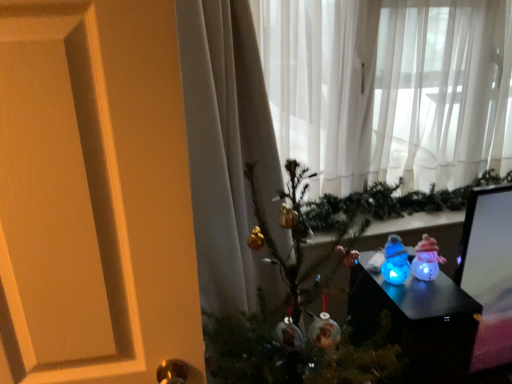
Question: From a real-world perspective, relative to translucent plastic snowmen at lower right, is sheer white curtain at upper center vertically above or below?

Choices:
 (A) below
 (B) above

Answer: (B)

Question: Would you say sheer white curtain at upper center is to the left or to the right of translucent plastic snowmen at lower right in the picture?

Choices:
 (A) left
 (B) right

Answer: (B)

Question: Estimate the real-world distances between objects in this image. Which object is farther from the metallic gold ornaments at center?

Choices:
 (A) sheer white curtain at upper center
 (B) translucent plastic snowman at center-right, the 2th toy viewed from the left
 (C) translucent plastic snowmen at lower right
 (D) blue translucent snowman at center, the first toy from the left

Answer: (A)

Question: Based on their relative distances, which object is nearer to the translucent plastic snowmen at lower right?

Choices:
 (A) sheer white curtain at upper center
 (B) translucent plastic snowman at center-right, marked as the 1th toy in a right-to-left arrangement
 (C) blue translucent snowman at center, the first toy from the left
 (D) metallic gold ornaments at center

Answer: (C)